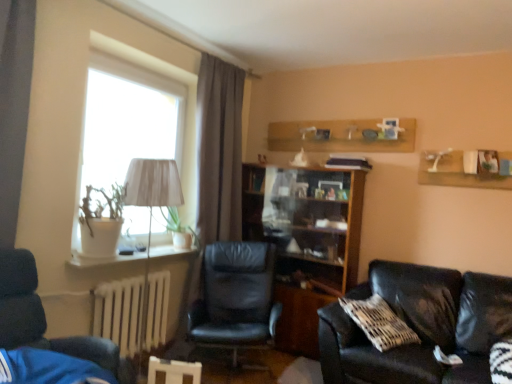
Question: From a real-world perspective, is black leather couch at lower right physically located above or below white fabric lampshade at left?

Choices:
 (A) above
 (B) below

Answer: (B)

Question: Is point (484, 380) closer or farther from the camera than point (146, 268)?

Choices:
 (A) closer
 (B) farther

Answer: (A)

Question: Which of these objects is positioned farthest from the black leather chair at center, which ranks as the second chair in front-to-back order?

Choices:
 (A) dark blue leather chair at left, the first chair from the left
 (B) white fabric lampshade at left
 (C) white painted metal radiator at lower left
 (D) black leather couch at lower right
 (E) wooden bookshelf at center

Answer: (A)

Question: Estimate the real-world distances between objects in this image. Which object is farther from the white fabric lampshade at left?

Choices:
 (A) wooden bookshelf at center
 (B) white painted metal radiator at lower left
 (C) dark blue leather chair at left, the 2th chair viewed from the back
 (D) black leather couch at lower right
 (E) black leather chair at center, which ranks as the second chair in front-to-back order

Answer: (D)